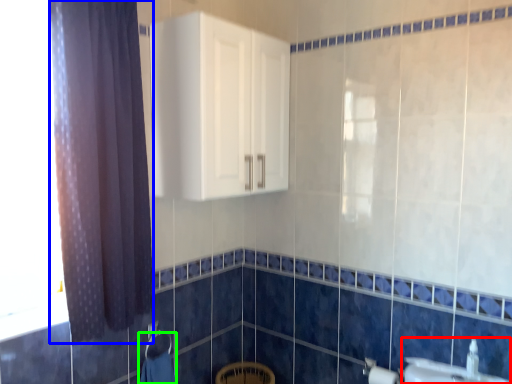
Question: Which object is the farthest from sink (highlighted by a red box)? Choose among these: curtain (highlighted by a blue box) or bath towel (highlighted by a green box).

Choices:
 (A) curtain
 (B) bath towel

Answer: (A)